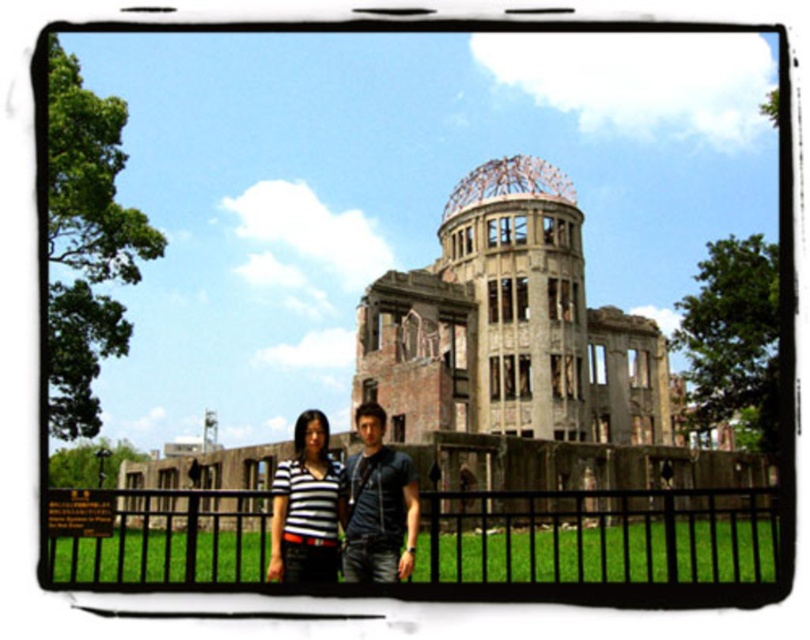
Is rustic stone dome at center above dark blue t-shirt at center?

Yes, rustic stone dome at center is above dark blue t-shirt at center.

From the picture: Which is above, rustic stone dome at center or dark blue t-shirt at center?

rustic stone dome at center is higher up.

The height and width of the screenshot is (640, 810). Find the location of `rustic stone dome at center`. rustic stone dome at center is located at coordinates (527, 356).

You are a GUI agent. You are given a task and a screenshot of the screen. Output one action in this format:
    pyautogui.click(x=<x>, y=<y>)
    Task: Click on the rustic stone dome at center
    This screenshot has width=810, height=640.
    Given the screenshot: What is the action you would take?
    pyautogui.click(x=527, y=356)

Which is below, dark blue t-shirt at center or striped fabric shirt at center?

striped fabric shirt at center is lower down.

Can you confirm if dark blue t-shirt at center is taller than striped fabric shirt at center?

Incorrect, dark blue t-shirt at center's height is not larger of striped fabric shirt at center's.

What are the coordinates of `dark blue t-shirt at center` in the screenshot? It's located at (378, 506).

Is rustic stone dome at center wider than black metal fence at lower center?

Indeed, rustic stone dome at center has a greater width compared to black metal fence at lower center.

Can you confirm if rustic stone dome at center is thinner than black metal fence at lower center?

Incorrect, rustic stone dome at center's width is not less than black metal fence at lower center's.

Between point (561, 369) and point (698, 538), which one is positioned behind?

The point (561, 369) is more distant.

Locate an element on the screen. The image size is (810, 640). rustic stone dome at center is located at coordinates (527, 356).